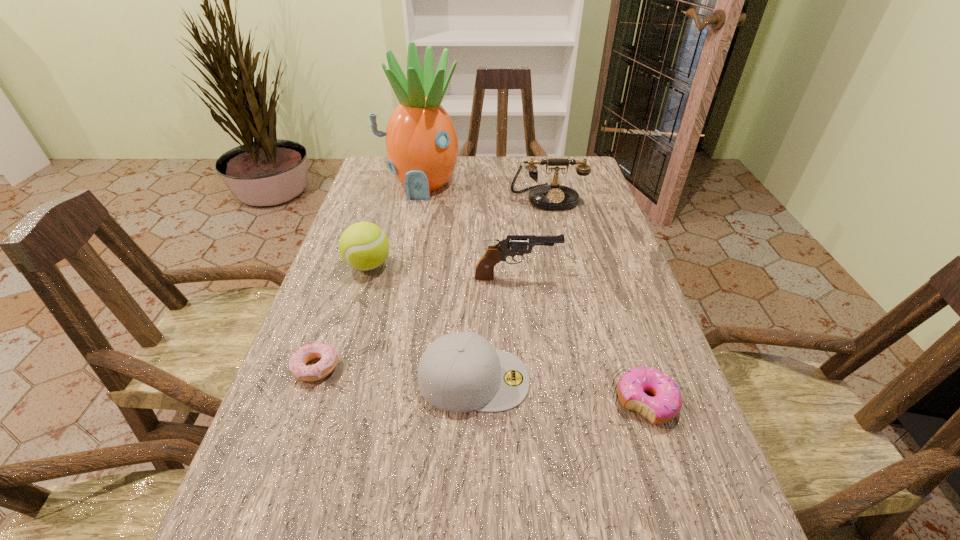
You are a GUI agent. You are given a task and a screenshot of the screen. Output one action in this format:
    pyautogui.click(x=<x>, y=<y>)
    Task: Click on the vacant region located on the dial of the telephone
    The image size is (960, 540).
    Given the screenshot: What is the action you would take?
    pyautogui.click(x=565, y=280)

You are a GUI agent. You are given a task and a screenshot of the screen. Output one action in this format:
    pyautogui.click(x=<x>, y=<y>)
    Task: Click on the vacant space located along the barrel of the gun
    This screenshot has height=540, width=960.
    Given the screenshot: What is the action you would take?
    pyautogui.click(x=626, y=278)

The image size is (960, 540). I want to click on blank space located 0.140m on the right of the tennis ball, so click(449, 265).

Where is `free space located 0.120m on the front-facing side of the cap`? This screenshot has height=540, width=960. free space located 0.120m on the front-facing side of the cap is located at coordinates (593, 379).

Locate an element on the screen. vacant space located 0.370m on the back of the sixth tallest object is located at coordinates (599, 256).

What are the coordinates of `free space located on the front of the shortest object` in the screenshot? It's located at (284, 457).

At what (x,y) coordinates should I click in order to perform the action: click on pineapple at the far edge. Please return your answer as a coordinate pair (x, y). This screenshot has height=540, width=960. Looking at the image, I should click on (422, 147).

Locate an element on the screen. This screenshot has height=540, width=960. telephone present at the far edge is located at coordinates (554, 196).

Locate an element on the screen. The height and width of the screenshot is (540, 960). pineapple positioned at the left edge is located at coordinates (422, 147).

At what (x,y) coordinates should I click in order to perform the action: click on tennis ball that is at the left edge. Please return your answer as a coordinate pair (x, y). This screenshot has height=540, width=960. Looking at the image, I should click on (364, 246).